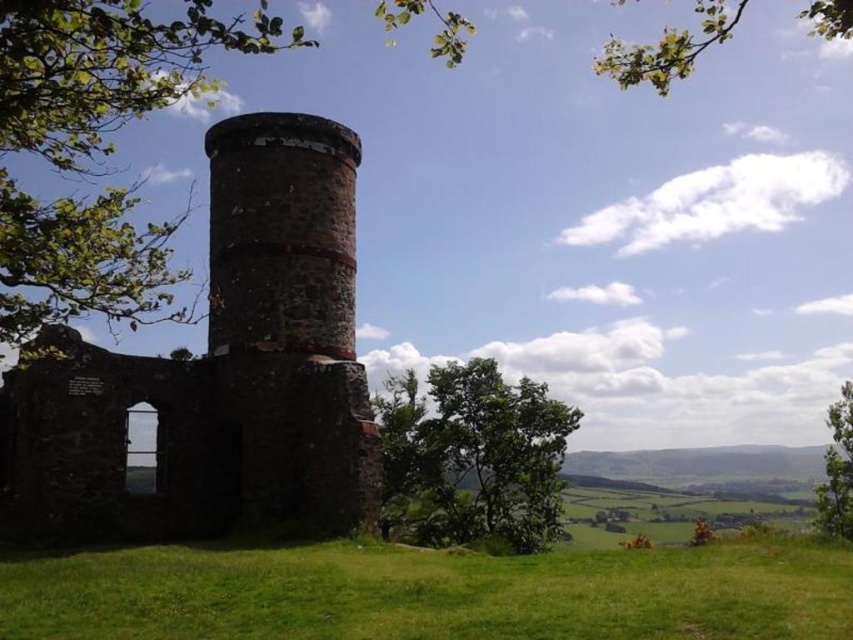
You are standing on the green grass at lower center looking up. Which direction should you face to see the rustic stone tower at center?

You should look upward since the rustic stone tower at center is above the green grass at lower center.